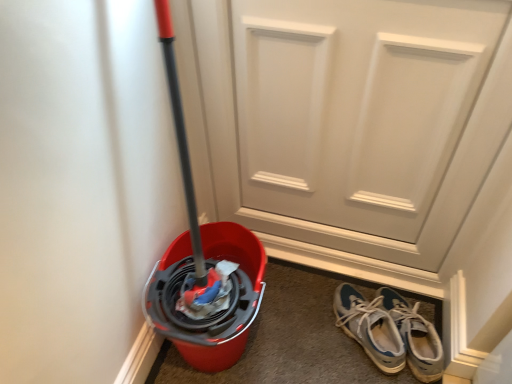
Identify the location of blank space to the left of blue suede sneakers at lower right. This screenshot has height=384, width=512. (306, 334).